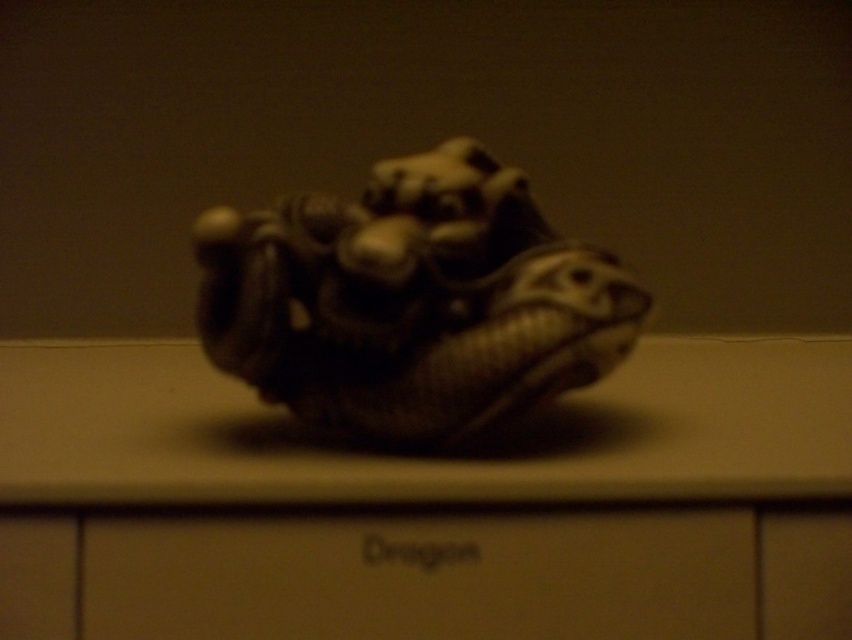
Who is lower down, matte stone dragon at center or matte brown drawer at center?

matte brown drawer at center is below.

The image size is (852, 640). In order to click on matte stone dragon at center in this screenshot , I will do `click(412, 300)`.

I want to click on matte stone dragon at center, so click(x=412, y=300).